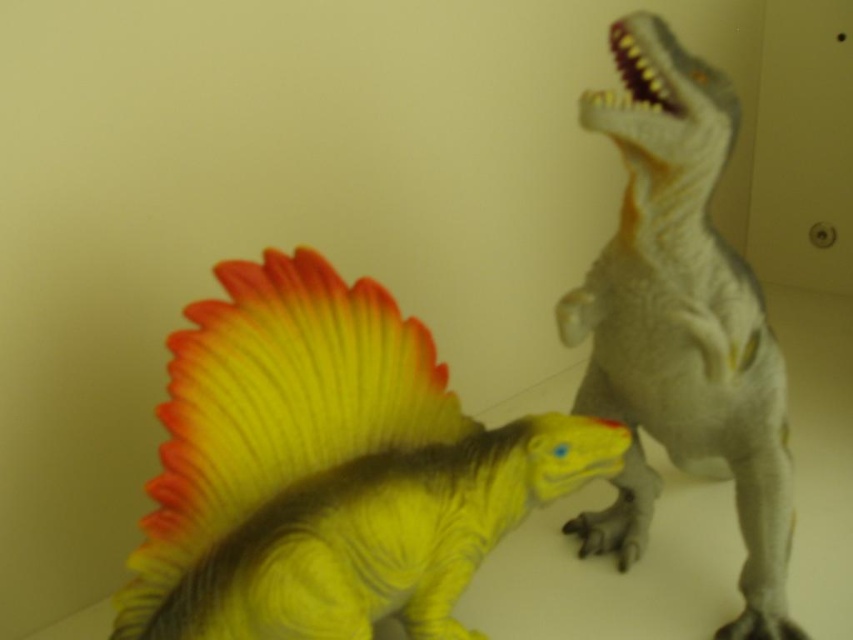
You are looking at two points in the image of the two toy dinosaurs. The first point is at coordinates point (228, 440) and the second is at point (613, 282). Which point is nearer to you?

Point (228, 440) is closer to the viewer than point (613, 282).

You are standing in a room with two toy dinosaurs. You notice a point marked at coordinates (328,468). Which dinosaur is closest to this point?

The shiny yellow dinosaur at center is closest to the point at coordinates (328,468).

You are standing in front of the two toy dinosaurs. The shiny yellow dinosaur at center is positioned at coordinates 0.733 on the x and 0.386 on the y. If you want to place a sticker exactly at its location, where should you place it?

Place the sticker at the coordinates 0.733 on the x and 0.386 on the y where the shiny yellow dinosaur at center is located.